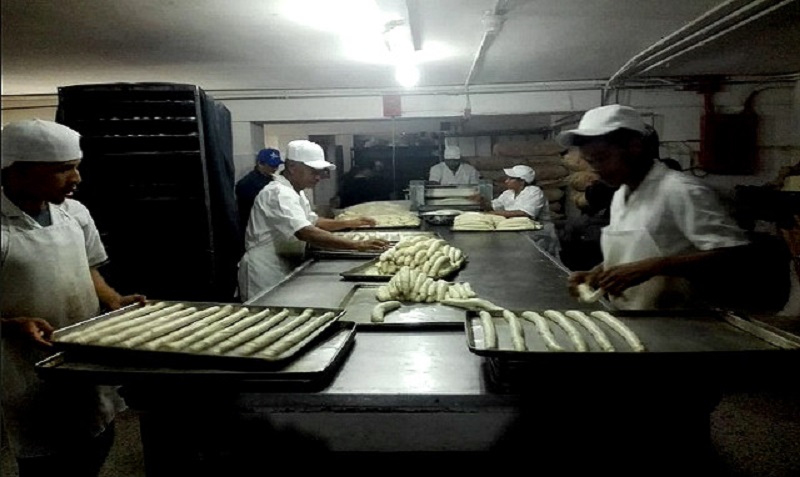
Where is `tray`? The image size is (800, 477). tray is located at coordinates (414, 317).